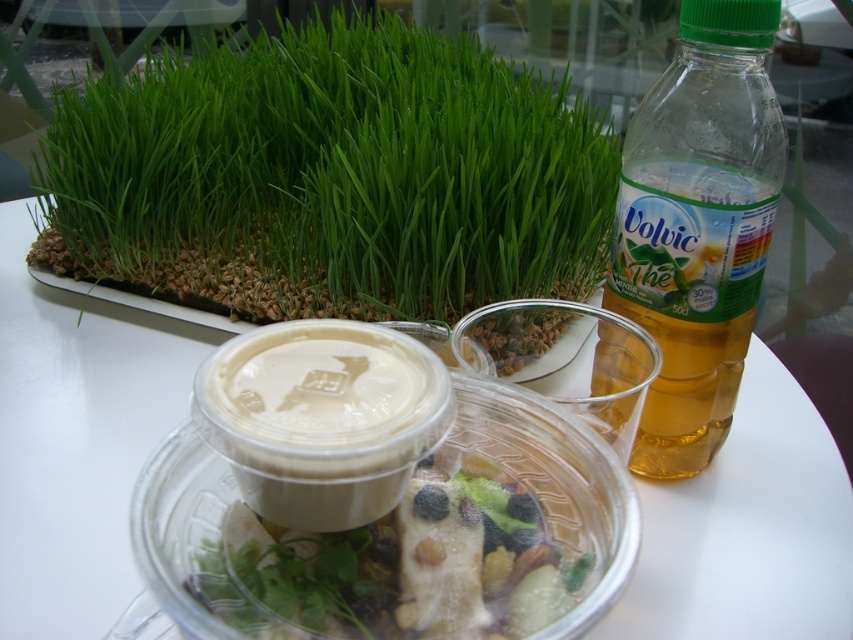
Question: Which point is closer to the camera?

Choices:
 (A) translucent plastic salad at center
 (B) translucent plastic bottle at right

Answer: (A)

Question: Can you confirm if green grass at upper left is wider than translucent plastic bottle at right?

Choices:
 (A) no
 (B) yes

Answer: (B)

Question: Is translucent plastic bottle at right bigger than translucent plastic salad at center?

Choices:
 (A) no
 (B) yes

Answer: (B)

Question: Which point is farther to the camera?

Choices:
 (A) (498, 131)
 (B) (466, 467)

Answer: (A)

Question: In this image, where is green grass at upper left located relative to translucent plastic salad at center?

Choices:
 (A) above
 (B) below

Answer: (A)

Question: Among these objects, which one is farthest from the camera?

Choices:
 (A) green grass at upper left
 (B) translucent plastic salad at center

Answer: (A)